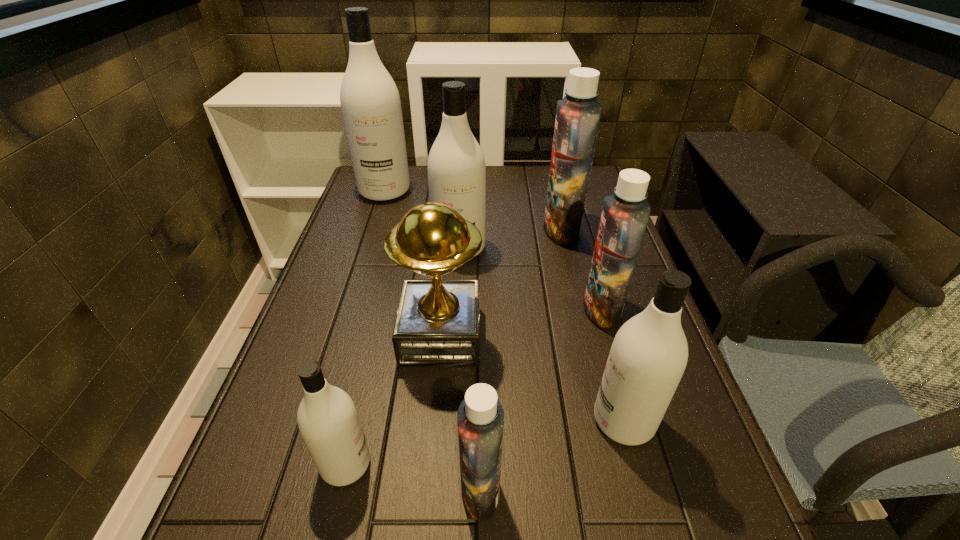
Locate an element on the screen. the nearest blue shampoo is located at coordinates (480, 419).

I want to click on the smallest white shampoo, so click(328, 421).

Image resolution: width=960 pixels, height=540 pixels. Find the location of `free space located 0.240m on the front-facing side of the tallest shampoo`. free space located 0.240m on the front-facing side of the tallest shampoo is located at coordinates (366, 250).

The height and width of the screenshot is (540, 960). Find the location of `vacant region located 0.340m on the front label of the biggest blue shampoo`. vacant region located 0.340m on the front label of the biggest blue shampoo is located at coordinates (430, 230).

This screenshot has width=960, height=540. Identify the location of vacant position located 0.240m on the front label of the biggest blue shampoo. (464, 230).

At what (x,y) coordinates should I click in order to perform the action: click on vacant space located on the front label of the biggest blue shampoo. Please return your answer as a coordinate pair (x, y). The width and height of the screenshot is (960, 540). Looking at the image, I should click on (457, 230).

Locate an element on the screen. The image size is (960, 540). free space located 0.170m on the front-facing side of the second white shampoo from right to left is located at coordinates (456, 308).

Find the location of `free space located 0.160m on the front label of the second nearest blue shampoo`. free space located 0.160m on the front label of the second nearest blue shampoo is located at coordinates (517, 309).

Find the location of a particular element. free location located 0.160m on the front label of the second nearest blue shampoo is located at coordinates [517, 309].

Locate an element on the screen. The height and width of the screenshot is (540, 960). vacant region located on the front label of the second nearest blue shampoo is located at coordinates (546, 309).